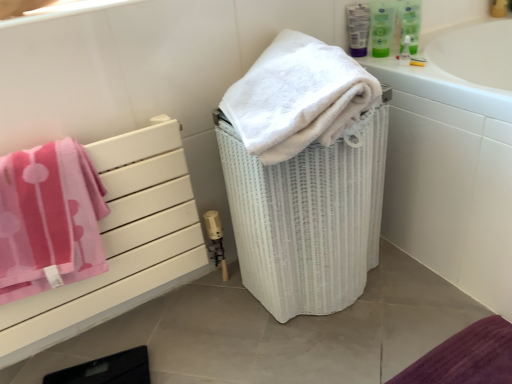
Where is `empty space that is to the right of pink fabric towel at left`? empty space that is to the right of pink fabric towel at left is located at coordinates (230, 331).